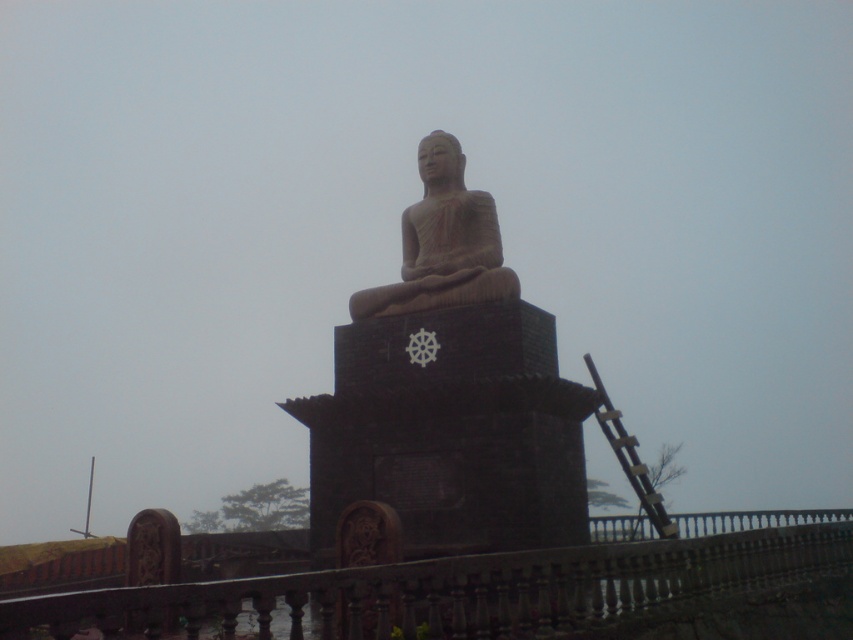
You are standing in front of the statue and want to place two offerings at the specified points. The first point is at coordinates point (517, 614) and the second is at point (438, 177). Which offering location is closer to the statue?

Point (517, 614) is in front of point (438, 177), so the offering at point (517, 614) will be closer to the statue.

You are standing in front of the brown stone statue at center and want to walk towards the brown wooden railing at lower center. In which direction should you move relative to the statue?

You should move to the left relative to the brown stone statue at center because the brown wooden railing at lower center is located to its left.

You are a tourist standing in front of the brown stone statue at center. You want to take a photo of the statue without any obstructions. Is the brown wooden railing at lower center blocking your view of the statue?

The brown wooden railing at lower center is below the brown stone statue at center, so it may block the lower part of the statue. Adjust your angle to ensure the entire statue is visible.